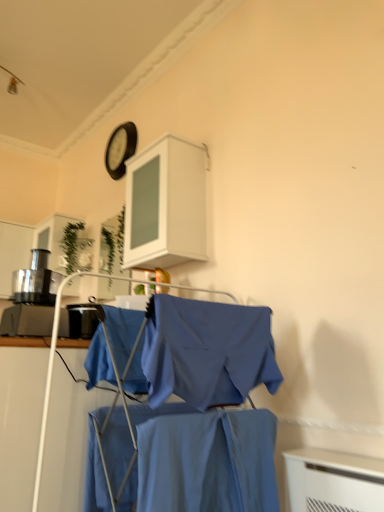
Question: Is white matte cabinet at upper center not near blue fabric shirt at center?

Choices:
 (A) yes
 (B) no

Answer: (A)

Question: From the image's perspective, does white matte cabinet at upper center appear lower than blue fabric shirt at center?

Choices:
 (A) no
 (B) yes

Answer: (A)

Question: Is white matte cabinet at upper center smaller than blue fabric shirt at center?

Choices:
 (A) yes
 (B) no

Answer: (A)

Question: Is white matte cabinet at upper center wider than blue fabric shirt at center?

Choices:
 (A) no
 (B) yes

Answer: (A)

Question: Is white matte cabinet at upper center further to the viewer compared to blue fabric shirt at center?

Choices:
 (A) yes
 (B) no

Answer: (A)

Question: Do you think smooth cotton shirt at center, which is the 1th fabric in front-to-back order, is within blue fabric shirt at center, or outside of it?

Choices:
 (A) outside
 (B) inside

Answer: (B)

Question: From a real-world perspective, is smooth cotton shirt at center, the 2th fabric from the left, physically located above or below blue fabric shirt at center?

Choices:
 (A) above
 (B) below

Answer: (B)

Question: From their relative heights in the image, would you say smooth cotton shirt at center, the 1th fabric positioned from the right, is taller or shorter than blue fabric shirt at center?

Choices:
 (A) tall
 (B) short

Answer: (B)

Question: Does point (258, 460) appear closer or farther from the camera than point (254, 429)?

Choices:
 (A) farther
 (B) closer

Answer: (B)

Question: From a real-world perspective, is blue fabric shirt at center positioned above or below blue fabric shirt at center?

Choices:
 (A) below
 (B) above

Answer: (A)

Question: In the image, is blue fabric shirt at center on the left side or the right side of blue fabric shirt at center?

Choices:
 (A) right
 (B) left

Answer: (B)

Question: Based on their sizes in the image, would you say blue fabric shirt at center is bigger or smaller than blue fabric shirt at center?

Choices:
 (A) small
 (B) big

Answer: (B)

Question: Choose the correct answer: Is blue fabric shirt at center inside blue fabric shirt at center or outside it?

Choices:
 (A) outside
 (B) inside

Answer: (A)

Question: Is white matte cabinet at upper center in front of or behind black matte clock at upper center in the image?

Choices:
 (A) front
 (B) behind

Answer: (A)

Question: Is white matte cabinet at upper center bigger or smaller than black matte clock at upper center?

Choices:
 (A) big
 (B) small

Answer: (A)